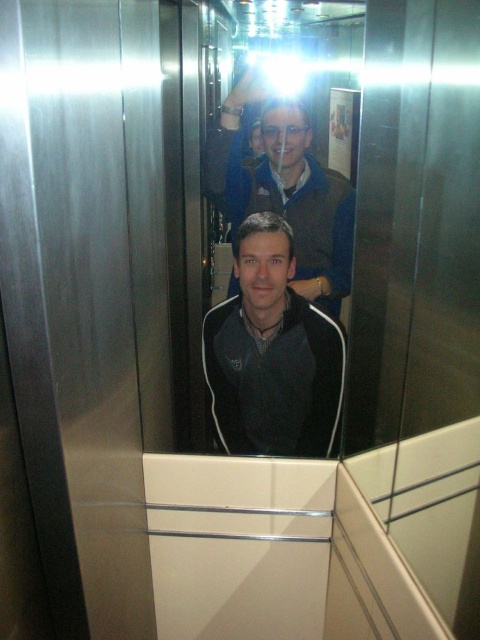
Is black matte jacket at center positioned behind matte black jacket at center?

No, it is in front of matte black jacket at center.

Measure the distance between black matte jacket at center and camera.

black matte jacket at center is 1.38 meters from camera.

Does point (259, 257) come behind point (265, 122)?

No, it is in front of (265, 122).

Find the location of `black matte jacket at center`. black matte jacket at center is located at coordinates (272, 353).